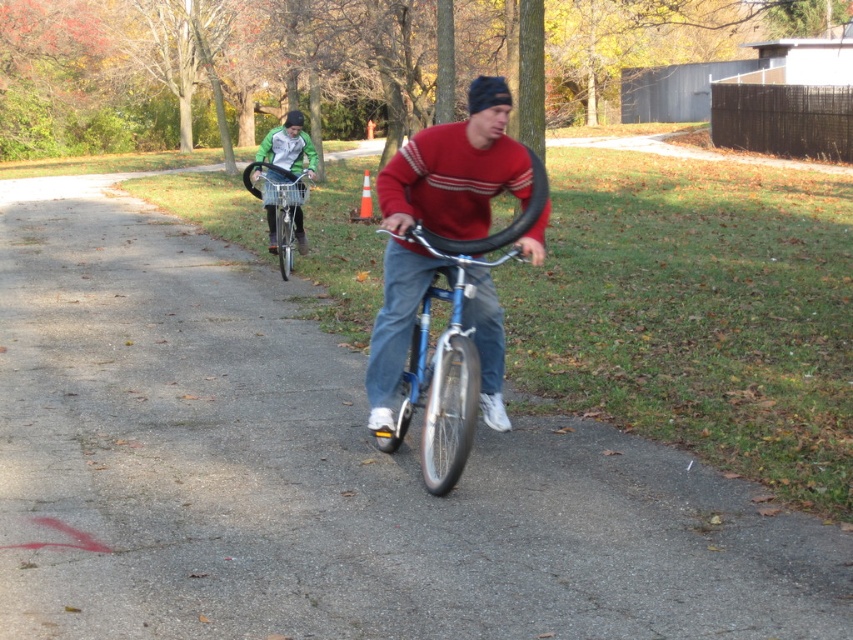
Is blue metallic bicycle at center thinner than silver metallic bicycle at center?

No.

What do you see at coordinates (323, 474) in the screenshot?
I see `blue metallic bicycle at center` at bounding box center [323, 474].

This screenshot has width=853, height=640. I want to click on blue metallic bicycle at center, so click(x=323, y=474).

Consider the image. Which is above, matte red sweater at center or silver metallic bicycle at center?

silver metallic bicycle at center is higher up.

The width and height of the screenshot is (853, 640). Find the location of `matte red sweater at center`. matte red sweater at center is located at coordinates (456, 170).

Is matte red sweater at center shorter than matte black bicycle at center?

In fact, matte red sweater at center may be taller than matte black bicycle at center.

Who is shorter, matte red sweater at center or matte black bicycle at center?

matte black bicycle at center is shorter.

Between point (479, 188) and point (303, 243), which one is positioned in front?

Positioned in front is point (479, 188).

This screenshot has height=640, width=853. Find the location of `matte red sweater at center`. matte red sweater at center is located at coordinates (456, 170).